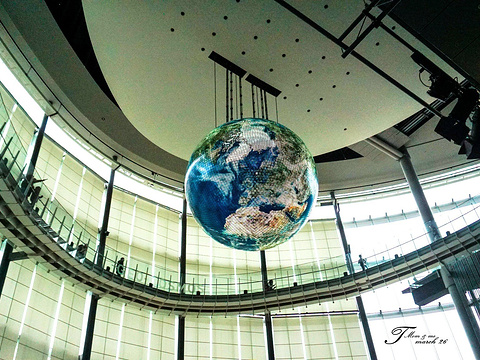
Locate an element on the screen. windows is located at coordinates (380, 231), (315, 246), (207, 248), (157, 231), (92, 195).